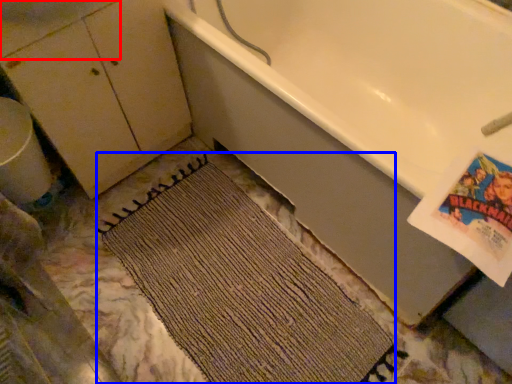
Question: Which object is further to the camera taking this photo, sink (highlighted by a red box) or doormat (highlighted by a blue box)?

Choices:
 (A) sink
 (B) doormat

Answer: (B)